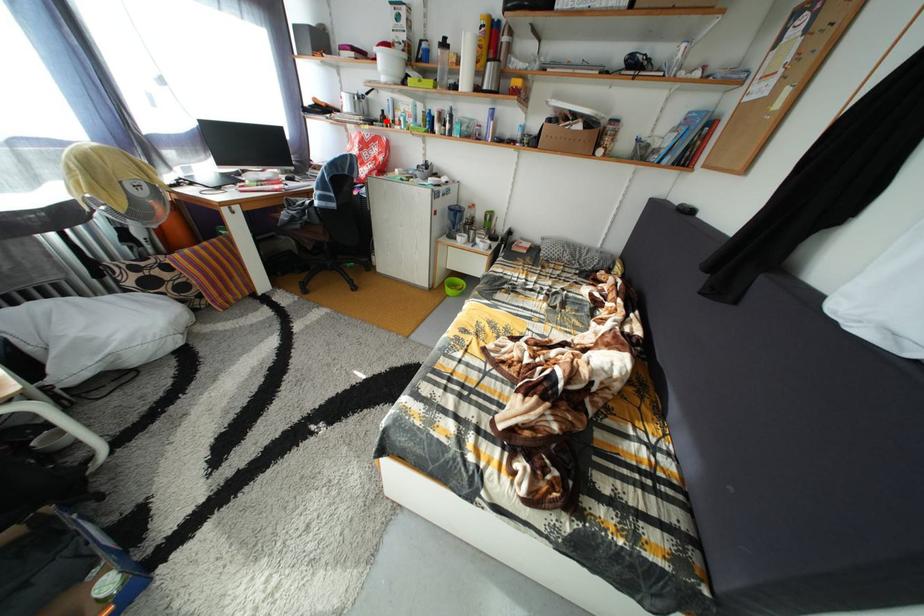
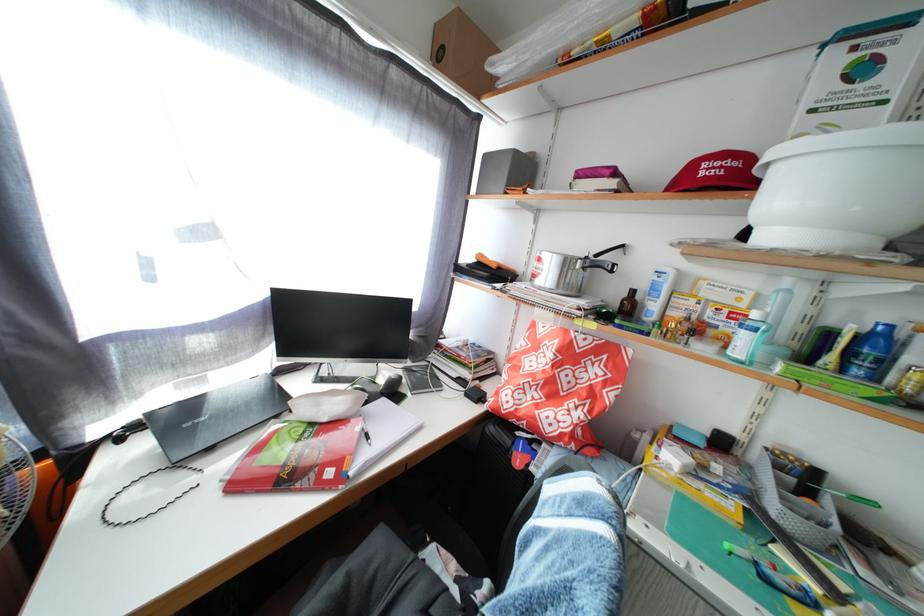
Question: I am providing you with two images of the same scene from different viewpoints. In image1, a red point is highlighted. Considering the same 3D point in image2, which of the following is correct?

Choices:
 (A) It is closer
 (B) It is farther

Answer: (B)